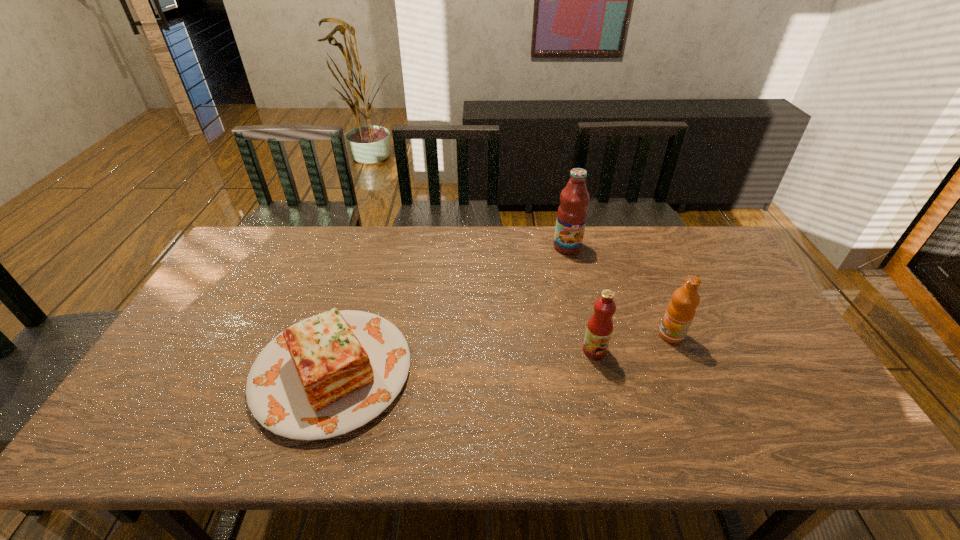
You are a GUI agent. You are given a task and a screenshot of the screen. Output one action in this format:
    pyautogui.click(x=<x>, y=<y>)
    Task: Click on the object present at the far edge
    
    Given the screenshot: What is the action you would take?
    pyautogui.click(x=572, y=213)

Find the location of a particular element. This screenshot has height=540, width=960. object that is at the near edge is located at coordinates (327, 375).

This screenshot has width=960, height=540. In the image, there is a desktop. Identify the location of free space at the far edge. (536, 258).

Image resolution: width=960 pixels, height=540 pixels. What are the coordinates of `free space at the near edge` in the screenshot? It's located at (406, 449).

Locate an element on the screen. This screenshot has width=960, height=540. free location at the left edge of the desktop is located at coordinates (195, 322).

Locate an element on the screen. The image size is (960, 540). vacant space at the right edge of the desktop is located at coordinates (751, 363).

This screenshot has width=960, height=540. I want to click on free space at the far left corner of the desktop, so click(260, 238).

Find the location of a particular element. vacant area between the rightmost object and the lasagna is located at coordinates (502, 353).

Where is `unoccupied area between the leftmost object and the rightmost fruit juice`? unoccupied area between the leftmost object and the rightmost fruit juice is located at coordinates (502, 353).

Where is `vacant point located between the rightmost object and the lasagna`? This screenshot has width=960, height=540. vacant point located between the rightmost object and the lasagna is located at coordinates (502, 353).